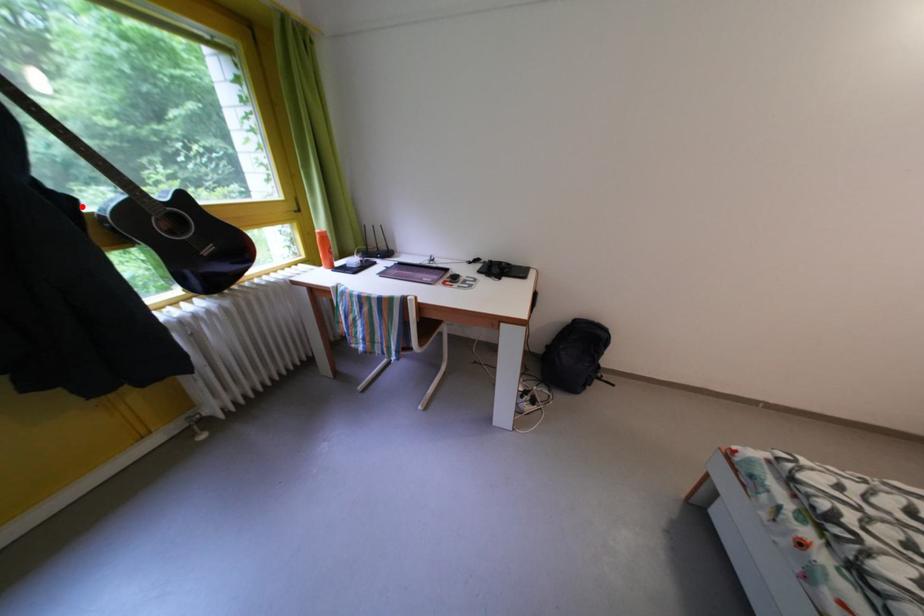
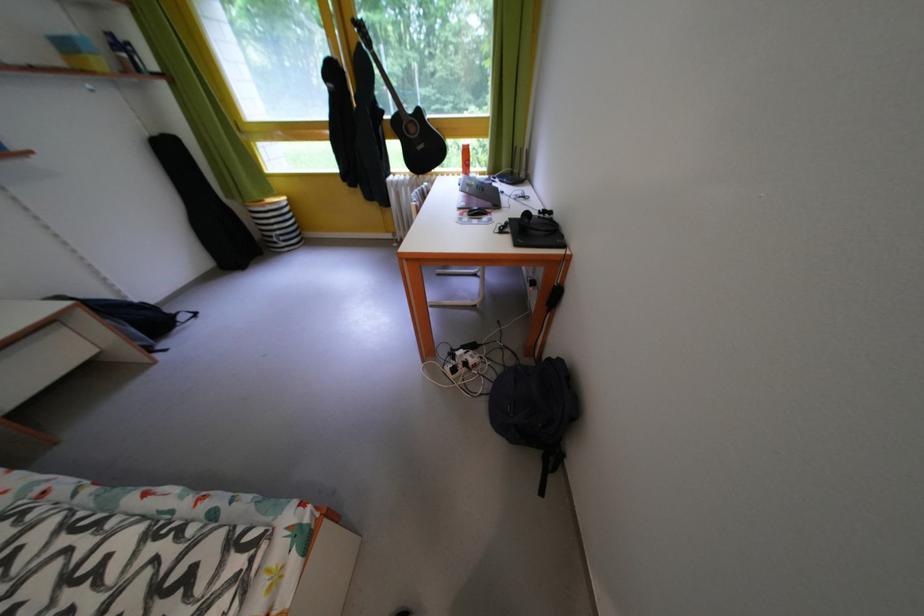
The point at the highlighted location is marked in the first image. Where is the corresponding point in the second image?

(393, 118)